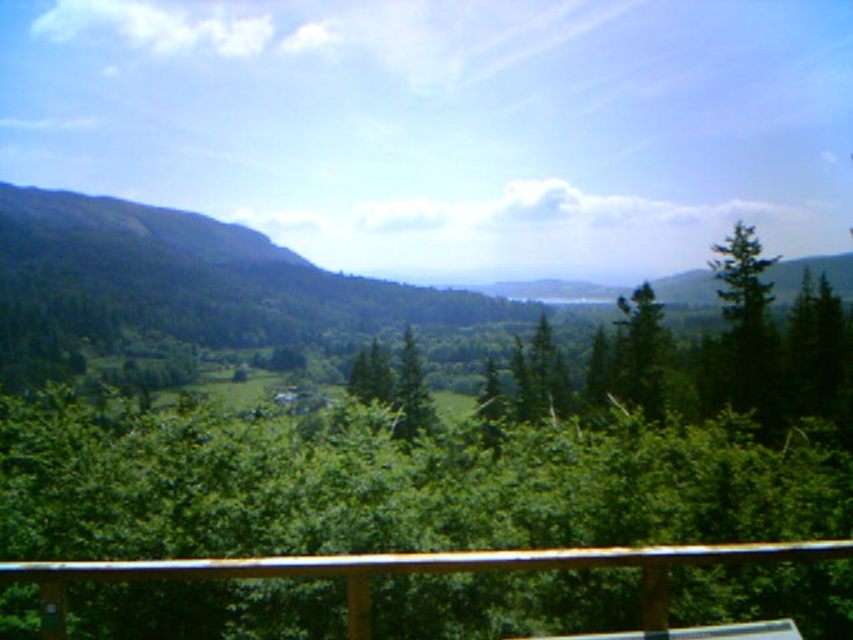
You are a painter standing on a balcony, and you want to paint the brown wooden rail at lower center and the green matte tree at right. Which object should you focus on first if you want to paint the thinner one first?

The brown wooden rail at lower center is thinner than the green matte tree at right, so you should focus on painting the brown wooden rail at lower center first.

You are standing on the wooden railing and looking out at the landscape. There are two points marked in the scene. The first point is at coordinate point [755,269] and the second is at coordinate point [401,348]. Which point is closer to you?

Point [755,269] is in front of point [401,348], so it is closer to you.